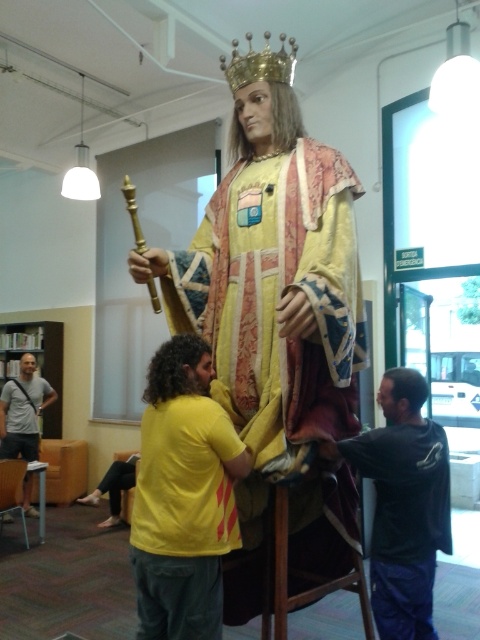
You are an interior designer inspecting the statue setup. You notice the gold textured fabric at center and the wooden chair at lower left. Which object is positioned higher in the image?

The gold textured fabric at center is above the wooden chair at lower left, so it is positioned higher in the image.